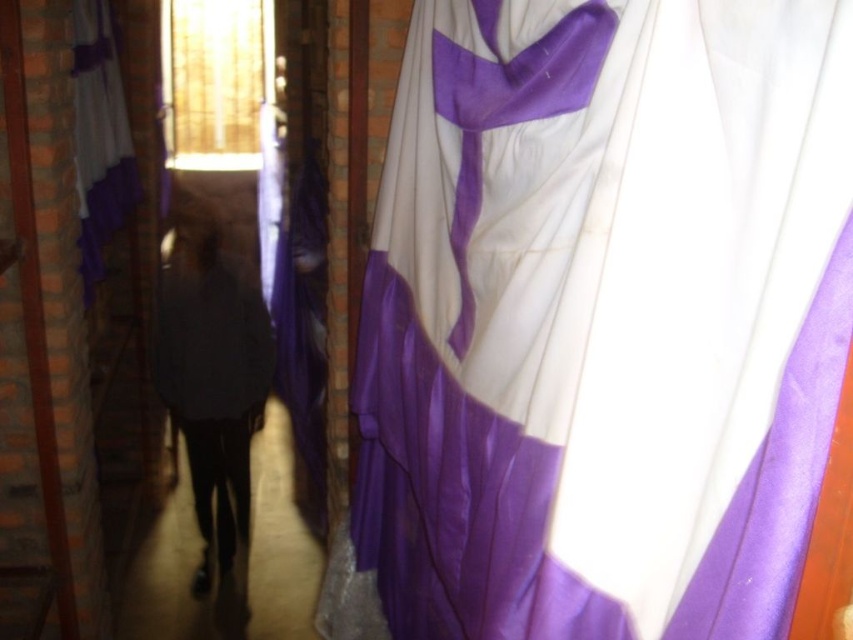
Is purple satin curtain at center to the left of purple satin curtain at left from the viewer's perspective?

In fact, purple satin curtain at center is to the right of purple satin curtain at left.

Does purple satin curtain at center appear under purple satin curtain at left?

Yes, purple satin curtain at center is below purple satin curtain at left.

This screenshot has width=853, height=640. I want to click on purple satin curtain at center, so click(x=604, y=316).

Can you confirm if matte black robe at center is shorter than purple satin curtain at left?

No, matte black robe at center is not shorter than purple satin curtain at left.

Is point (207, 380) less distant than point (96, 184)?

No, (207, 380) is further to viewer.

The width and height of the screenshot is (853, 640). Describe the element at coordinates (213, 385) in the screenshot. I see `matte black robe at center` at that location.

You are a GUI agent. You are given a task and a screenshot of the screen. Output one action in this format:
    pyautogui.click(x=<x>, y=<y>)
    Task: Click on the matte black robe at center
    This screenshot has width=853, height=640.
    Given the screenshot: What is the action you would take?
    pyautogui.click(x=213, y=385)

Between purple satin curtain at center and matte black robe at center, which one has less height?

matte black robe at center is shorter.

Can you confirm if purple satin curtain at center is wider than matte black robe at center?

Yes.

Locate an element on the screen. This screenshot has height=640, width=853. purple satin curtain at center is located at coordinates (604, 316).